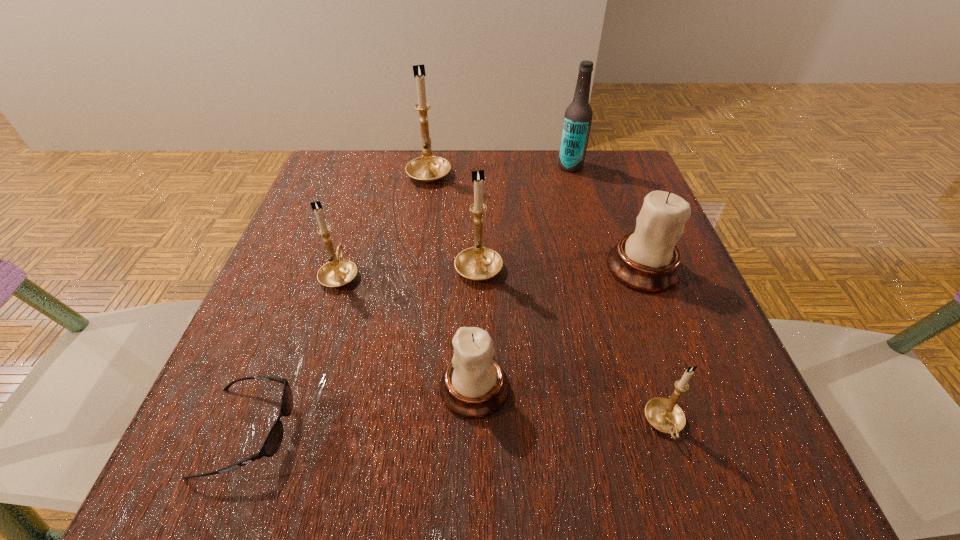
Locate which gold candle holder is the second closest to the smaller white candle holder. Please provide its 2D coordinates. Your answer should be formatted as a tuple, i.e. [(x, y)], where the tuple contains the x and y coordinates of a point satisfying the conditions above.

[(663, 414)]

At what (x,y) coordinates should I click in order to perform the action: click on blank space that satisfies the following two spatial constraints: 1. on the handle side of the third biggest gold candle holder; 2. on the right side of the right white candle holder. Please return your answer as a coordinate pair (x, y). Looking at the image, I should click on point(342,268).

The height and width of the screenshot is (540, 960). I want to click on vacant space that satisfies the following two spatial constraints: 1. on the back side of the smaller white candle holder; 2. on the left side of the farther white candle holder, so click(475, 268).

Find the location of `free region that satisfies the following two spatial constraints: 1. on the handle side of the rightmost gold candle holder; 2. on the front-facing side of the gray sunglasses`. free region that satisfies the following two spatial constraints: 1. on the handle side of the rightmost gold candle holder; 2. on the front-facing side of the gray sunglasses is located at coordinates (667, 431).

Find the location of `free location that satisfies the following two spatial constraints: 1. on the label of the beer bottle; 2. on the left side of the bigger white candle holder`. free location that satisfies the following two spatial constraints: 1. on the label of the beer bottle; 2. on the left side of the bigger white candle holder is located at coordinates (598, 268).

You are a GUI agent. You are given a task and a screenshot of the screen. Output one action in this format:
    pyautogui.click(x=<x>, y=<y>)
    Task: Click on the vacant space that satisfies the following two spatial constraints: 1. on the label of the beer bottle; 2. on the left side of the farther white candle holder
    This screenshot has width=960, height=540.
    Given the screenshot: What is the action you would take?
    pyautogui.click(x=598, y=268)